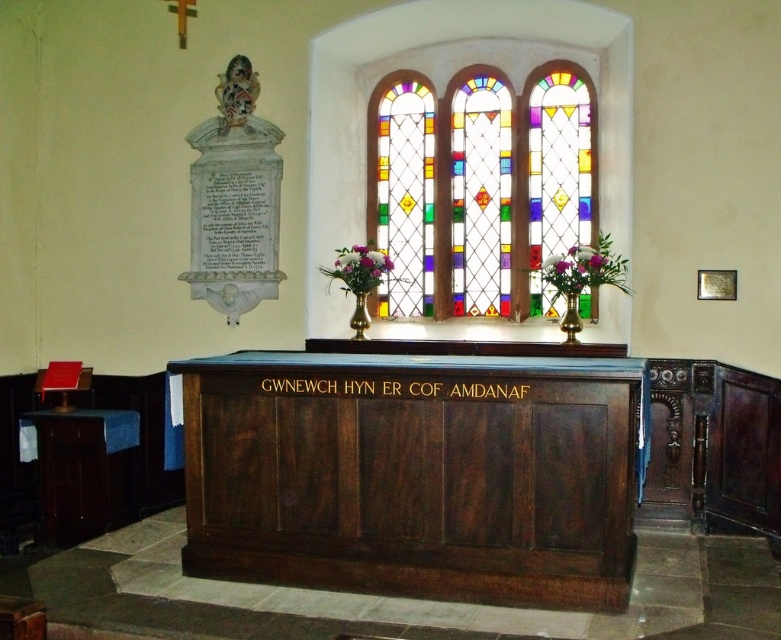
Based on the photo, who is taller, stained glass at upper center or black wood sign at center?

Standing taller between the two is stained glass at upper center.

Does stained glass at upper center appear on the right side of black wood sign at center?

Yes, stained glass at upper center is to the right of black wood sign at center.

Is point (530, 172) positioned before point (305, 381)?

No, (530, 172) is behind (305, 381).

Find the location of `stained glass at upper center`. stained glass at upper center is located at coordinates (480, 188).

Can you confirm if dark wood altar at center is thinner than black wood sign at center?

No.

Between point (294, 547) and point (369, 396), which one is positioned behind?

The point (294, 547) is more distant.

Which is in front, point (569, 412) or point (516, 392)?

Positioned in front is point (569, 412).

I want to click on dark wood altar at center, so click(414, 477).

Can you confirm if dark wood altar at center is positioned to the right of stained glass at upper center?

Incorrect, dark wood altar at center is not on the right side of stained glass at upper center.

Image resolution: width=781 pixels, height=640 pixels. I want to click on dark wood altar at center, so click(414, 477).

Is point (255, 538) farther from camera compared to point (562, 125)?

That is False.

Find the location of a particular element. This screenshot has height=640, width=781. dark wood altar at center is located at coordinates (x=414, y=477).